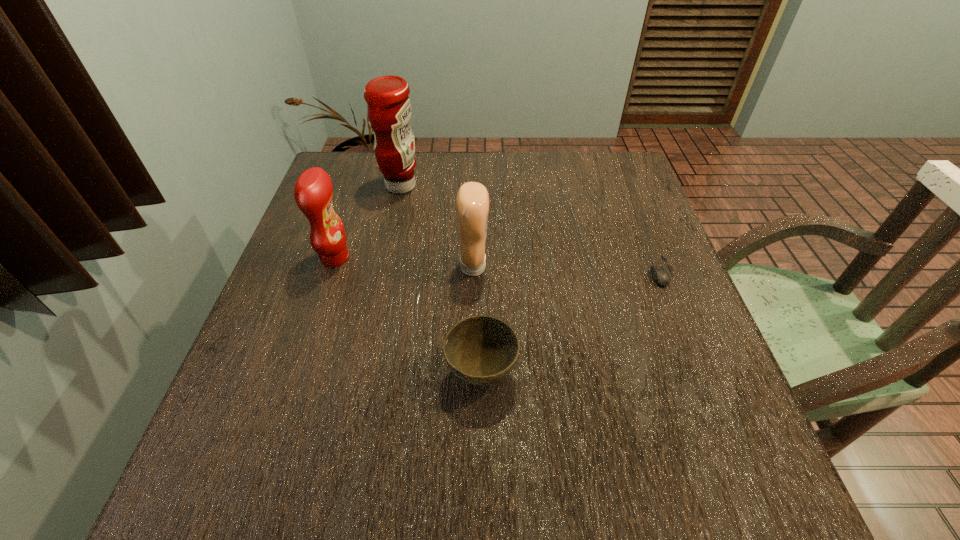
Locate an element on the screen. Image resolution: width=960 pixels, height=540 pixels. the tallest condiment is located at coordinates (388, 105).

You are a GUI agent. You are given a task and a screenshot of the screen. Output one action in this format:
    pyautogui.click(x=<x>, y=<y>)
    Task: Click on the tallest object
    The image size is (960, 540).
    Given the screenshot: What is the action you would take?
    pyautogui.click(x=388, y=105)

Identify the location of the leftmost object. The image size is (960, 540). (313, 191).

You are a GUI agent. You are given a task and a screenshot of the screen. Output one action in this format:
    pyautogui.click(x=<x>, y=<y>)
    Task: Click on the rightmost condiment
    The image size is (960, 540).
    Given the screenshot: What is the action you would take?
    pyautogui.click(x=472, y=202)

Where is `the nearest object`? the nearest object is located at coordinates (481, 350).

You are a GUI agent. You are given a task and a screenshot of the screen. Output one action in this format:
    pyautogui.click(x=<x>, y=<y>)
    Task: Click on the bowl
    This screenshot has height=540, width=960.
    Given the screenshot: What is the action you would take?
    pyautogui.click(x=481, y=350)

In order to click on the shortest object in this screenshot , I will do `click(660, 276)`.

You are a GUI agent. You are given a task and a screenshot of the screen. Output one action in this format:
    pyautogui.click(x=<x>, y=<y>)
    Task: Click on the rightmost object
    This screenshot has width=960, height=540.
    Given the screenshot: What is the action you would take?
    pyautogui.click(x=660, y=276)

In order to click on vacant position located on the front of the second condiment from left to right in this screenshot , I will do `click(378, 291)`.

Where is `free space located on the label side of the leftmost object`? Image resolution: width=960 pixels, height=540 pixels. free space located on the label side of the leftmost object is located at coordinates (396, 258).